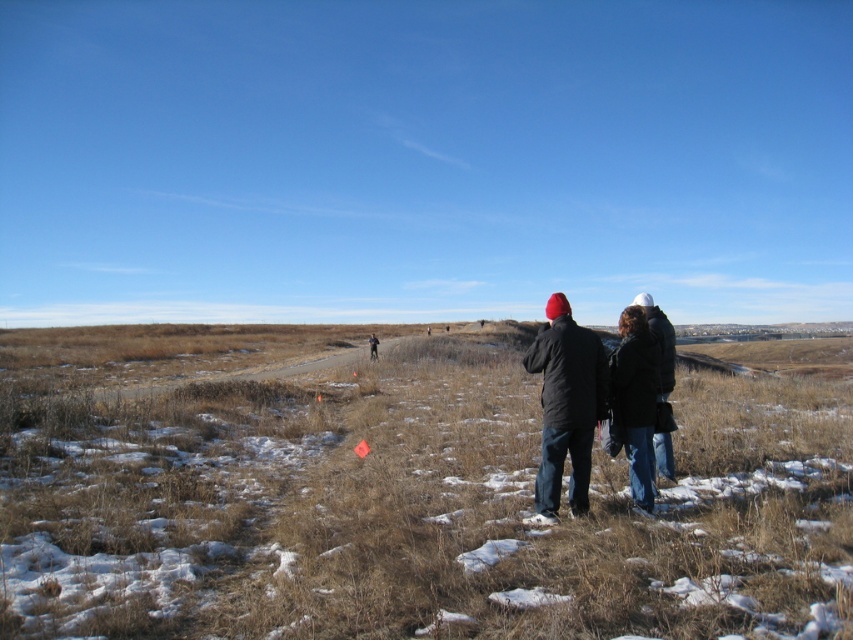
Image resolution: width=853 pixels, height=640 pixels. What are the coordinates of `dry grass at lower center` in the screenshot? It's located at (401, 500).

Measure the distance from dry grass at lower center to dark gray jacket at center.

The distance of dry grass at lower center from dark gray jacket at center is 62.36 feet.

Is point (416, 426) more distant than point (669, 340)?

That is True.

This screenshot has width=853, height=640. Identify the location of dry grass at lower center. (401, 500).

From the picture: Who is positioned more to the left, dry grass at lower center or black matte jackets at center?

Positioned to the left is dry grass at lower center.

Is point (109, 614) positioned in front of point (648, 512)?

Yes, it is in front of point (648, 512).

Who is more forward, (126,344) or (567,444)?

Point (567,444) is more forward.

The width and height of the screenshot is (853, 640). What are the coordinates of `dry grass at lower center` in the screenshot? It's located at (401, 500).

Does point (643, 344) come farther from viewer compared to point (653, 317)?

No, (643, 344) is in front of (653, 317).

Between black matte jackets at center and dark gray jacket at center, which one is positioned higher?

dark gray jacket at center is higher up.

Does point (543, 515) come in front of point (669, 384)?

That is True.

Identify the location of black matte jackets at center. (589, 404).